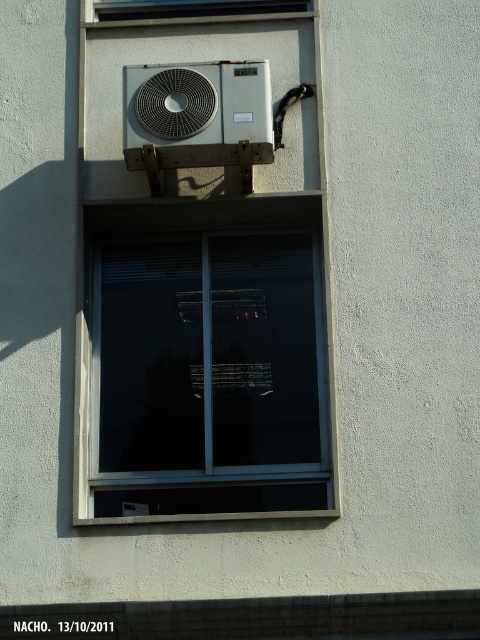
You are standing in front of the building and notice two points marked on the wall. The first point is at coordinates point [105,300], and the second is at point [214,4]. Which point is closer to you?

Point [105,300] is in front of point [214,4], so it is closer to you.

You are standing in front of a building wall with a window and an air conditioning unit. You notice a specific point at coordinates (197, 113). Can you identify what object this point is associated with?

The point at coordinates (197, 113) corresponds to the silver metallic air conditioner at upper center.

You are a window installer assessing the exterior wall. You need to replace the transparent glass window at upper center. The new window is the same size as the existing one. Considering the silver metallic air conditioner at upper center, will there be enough space to install the new window without moving the air conditioner?

The silver metallic air conditioner at upper center has a larger size compared to the transparent glass window at upper center. Since the new window is the same size as the existing one, there will be enough space to install it without moving the air conditioner because the air conditioner is already positioned above and not obstructing the window area.